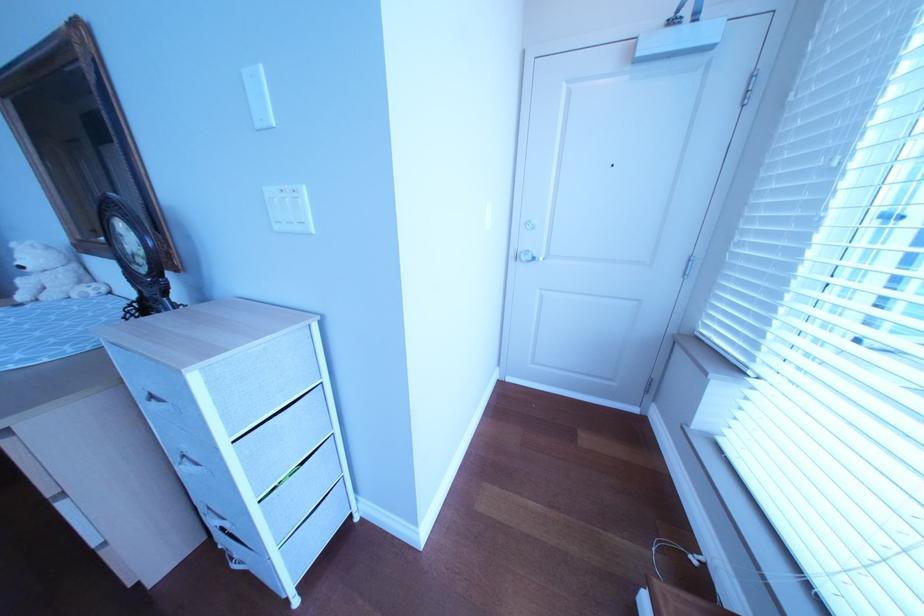
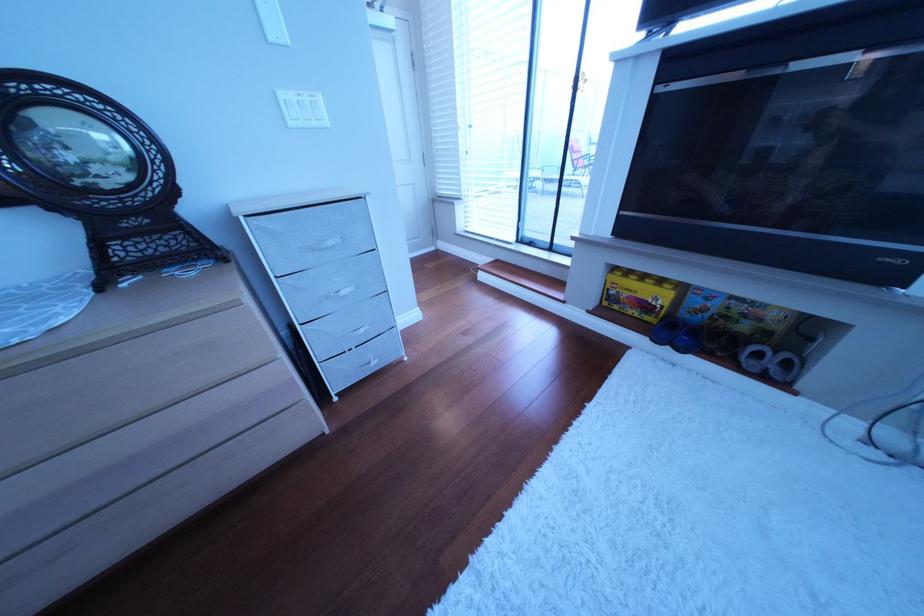
Find the pixel in the second image that matches the point at 292,229 in the first image.

(307, 126)